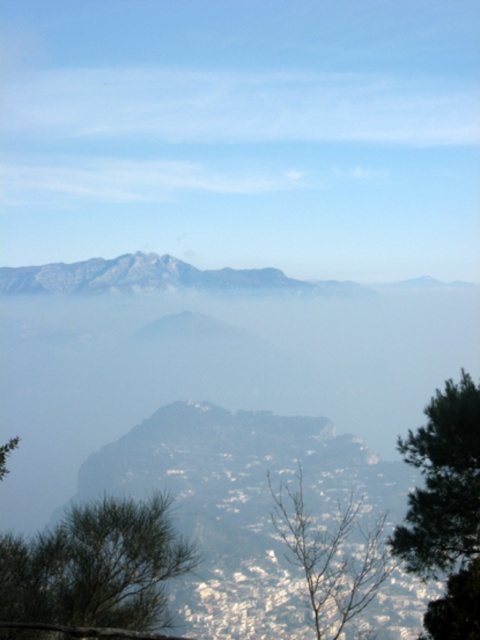
Question: Which of the following is the farthest from the observer?

Choices:
 (A) green matte tree at right
 (B) bare branches at lower center
 (C) green needle-like tree at lower left

Answer: (B)

Question: Does green needle-like tree at lower left come behind bare branches at lower center?

Choices:
 (A) yes
 (B) no

Answer: (B)

Question: Is green matte tree at right wider than bare branches at lower center?

Choices:
 (A) yes
 (B) no

Answer: (B)

Question: Is green needle-like tree at lower left bigger than bare branches at lower center?

Choices:
 (A) no
 (B) yes

Answer: (A)

Question: Which point is farther from the camera taking this photo?

Choices:
 (A) (443, 396)
 (B) (130, 602)

Answer: (A)

Question: Which point is closer to the camera?

Choices:
 (A) green needle-like tree at lower left
 (B) green matte tree at right

Answer: (A)